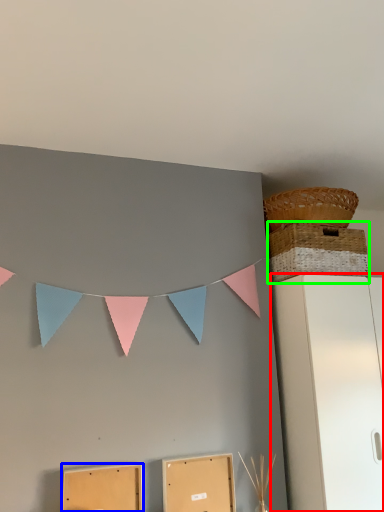
Question: Considering the real-world distances, which object is closest to furniture (highlighted by a red box)? cardboard box (highlighted by a blue box) or basket (highlighted by a green box).

Choices:
 (A) cardboard box
 (B) basket

Answer: (B)